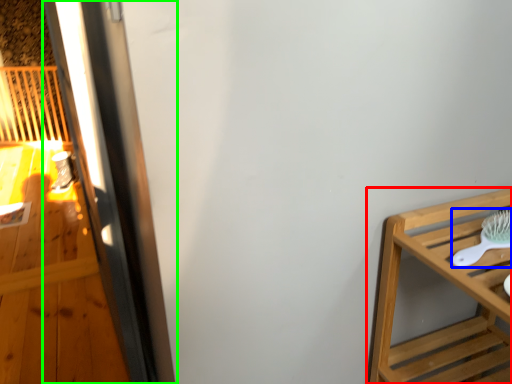
Question: Which object is positioned closest to furniture (highlighted by a red box)? Select from brush (highlighted by a blue box) and screen door (highlighted by a green box).

Choices:
 (A) brush
 (B) screen door

Answer: (A)